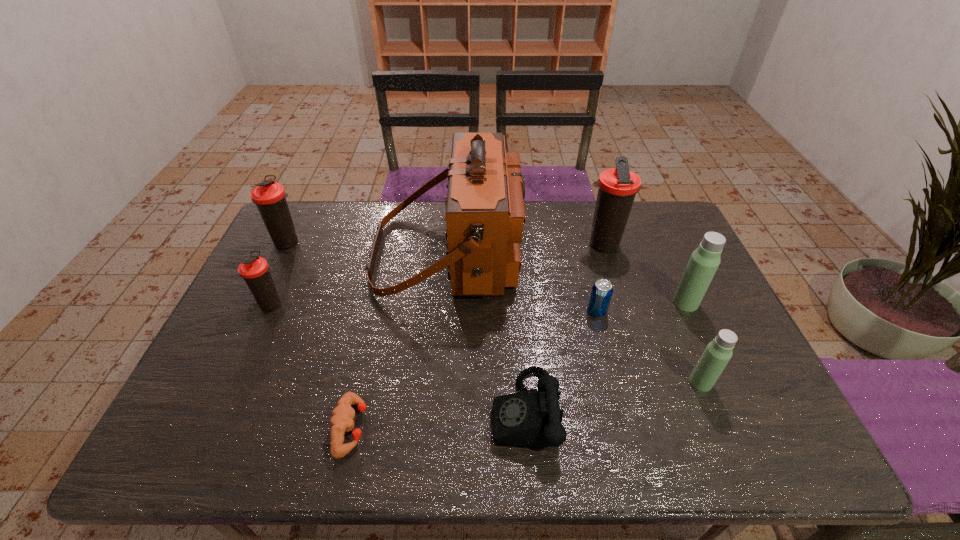
Image resolution: width=960 pixels, height=540 pixels. In order to click on the tallest object in this screenshot , I will do `click(485, 213)`.

Identify the location of satchel. (485, 213).

Where is `the third thermos bottle from left to right`? Image resolution: width=960 pixels, height=540 pixels. the third thermos bottle from left to right is located at coordinates (618, 186).

Identify the location of the biggest brown thermos bottle. (618, 186).

Find the location of a particular element. Image resolution: width=960 pixels, height=540 pixels. the second smallest brown thermos bottle is located at coordinates (270, 197).

Where is `the bigger light thermos bottle`? The width and height of the screenshot is (960, 540). the bigger light thermos bottle is located at coordinates (704, 261).

Where is `the nearest brown thermos bottle`? This screenshot has width=960, height=540. the nearest brown thermos bottle is located at coordinates (255, 270).

The width and height of the screenshot is (960, 540). I want to click on the nearest thermos bottle, so click(x=718, y=352).

This screenshot has height=540, width=960. Find the location of `the nearer light thermos bottle`. the nearer light thermos bottle is located at coordinates (718, 352).

The image size is (960, 540). What are the coordinates of `blue beer can` in the screenshot? It's located at (601, 293).